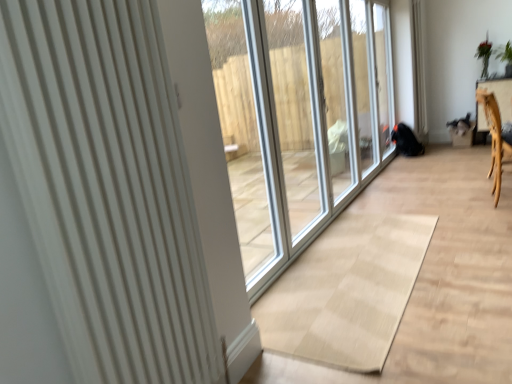
This screenshot has width=512, height=384. What do you see at coordinates (495, 138) in the screenshot? I see `wooden armchair at right` at bounding box center [495, 138].

In order to face wooden armchair at right, should I rotate leftwards or rightwards?

You should look right and rotate roughly 29.387 degrees.

Measure the distance between point (495, 154) and camera.

The depth of point (495, 154) is 11.53 feet.

Find the location of a particular element. wooden armchair at right is located at coordinates (495, 138).

In order to face white ribbed radiator at left, should I rotate leftwards or rightwards?

It's best to rotate left around 15.658 degrees.

What is the approximate height of white ribbed radiator at left?

The height of white ribbed radiator at left is 1.36 meters.

The width and height of the screenshot is (512, 384). What do you see at coordinates (106, 188) in the screenshot? I see `white ribbed radiator at left` at bounding box center [106, 188].

Find the location of a particular element. white ribbed radiator at left is located at coordinates (106, 188).

This screenshot has width=512, height=384. Identify the location of wooden armchair at right. (495, 138).

Considering the relative positions of wooden armchair at right and white ribbed radiator at left in the image provided, is wooden armchair at right to the right of white ribbed radiator at left from the viewer's perspective?

Yes, wooden armchair at right is to the right of white ribbed radiator at left.

Relative to white ribbed radiator at left, is wooden armchair at right in front or behind?

In the image, wooden armchair at right appears behind white ribbed radiator at left.

Is point (500, 168) positioned in front of point (62, 42)?

That is False.

From the image's perspective, between wooden armchair at right and white ribbed radiator at left, which one is located above?

wooden armchair at right.

From a real-world perspective, is wooden armchair at right physically below white ribbed radiator at left?

Yes.

Which of these two, wooden armchair at right or white ribbed radiator at left, is thinner?

white ribbed radiator at left.

From their relative heights in the image, would you say wooden armchair at right is taller or shorter than white ribbed radiator at left?

Clearly, wooden armchair at right is shorter compared to white ribbed radiator at left.

Can you confirm if wooden armchair at right is smaller than white ribbed radiator at left?

Incorrect, wooden armchair at right is not smaller in size than white ribbed radiator at left.

Is wooden armchair at right positioned beyond the bounds of white ribbed radiator at left?

Absolutely, wooden armchair at right is external to white ribbed radiator at left.

Is wooden armchair at right not near white ribbed radiator at left?

Yes, wooden armchair at right and white ribbed radiator at left are quite far apart.

Is wooden armchair at right looking in the opposite direction of white ribbed radiator at left?

wooden armchair at right is not turned away from white ribbed radiator at left.

The height and width of the screenshot is (384, 512). In order to click on radiator on the left of wooden armchair at right in this screenshot , I will do `click(106, 188)`.

Between white ribbed radiator at left and wooden armchair at right, which one appears on the right side from the viewer's perspective?

wooden armchair at right.

Between white ribbed radiator at left and wooden armchair at right, which one is positioned in front?

white ribbed radiator at left.

Which is less distant, (77, 157) or (500, 165)?

Point (77, 157) is positioned closer to the camera compared to point (500, 165).

From the image's perspective, who appears lower, white ribbed radiator at left or wooden armchair at right?

From the image's view, white ribbed radiator at left is below.

Consider the image. From a real-world perspective, is white ribbed radiator at left physically below wooden armchair at right?

No, from a real-world perspective, white ribbed radiator at left is not under wooden armchair at right.

Which object is wider, white ribbed radiator at left or wooden armchair at right?

wooden armchair at right.

Can you confirm if white ribbed radiator at left is taller than wooden armchair at right?

Yes.

Between white ribbed radiator at left and wooden armchair at right, which one has larger size?

wooden armchair at right.

Can wooden armchair at right be found inside white ribbed radiator at left?

Definitely not — wooden armchair at right is not inside white ribbed radiator at left.

Is white ribbed radiator at left in contact with wooden armchair at right?

No, white ribbed radiator at left is not in contact with wooden armchair at right.

Could you tell me if white ribbed radiator at left is facing wooden armchair at right?

No, white ribbed radiator at left is not turned towards wooden armchair at right.

What's the angular difference between white ribbed radiator at left and wooden armchair at right's facing directions?

The angle between the facing direction of white ribbed radiator at left and the facing direction of wooden armchair at right is 2.02 degrees.

Identify the location of radiator below the wooden armchair at right (from the image's perspective). The image size is (512, 384). (106, 188).

Image resolution: width=512 pixels, height=384 pixels. What are the coordinates of `armchair located on the right of white ribbed radiator at left` in the screenshot? It's located at (495, 138).

Identify the location of radiator that appears below the wooden armchair at right (from the image's perspective). The image size is (512, 384). (106, 188).